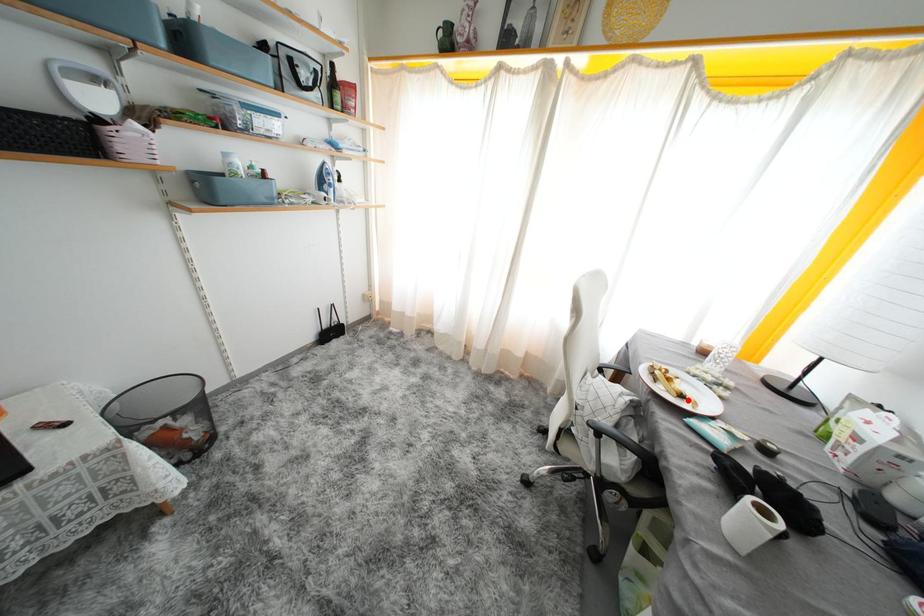
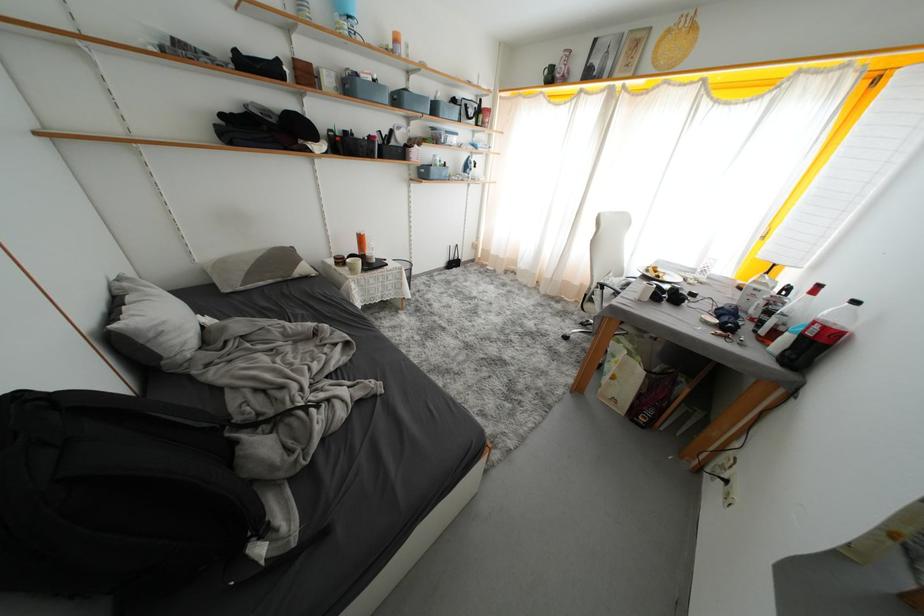
Question: I am providing you with two images of the same scene from different viewpoints. Given a red point in image1, look at the same physical point in image2. Is it:

Choices:
 (A) Closer to the viewpoint
 (B) Farther from the viewpoint

Answer: (A)